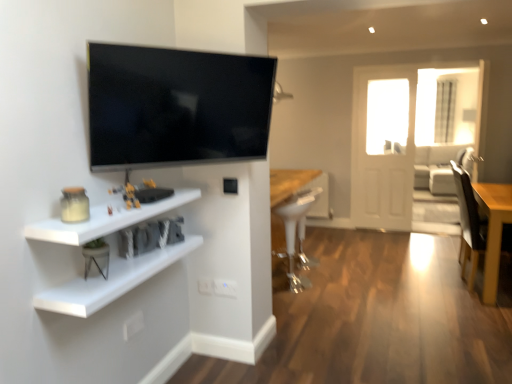
Question: Considering the relative sizes of white glossy stool at center and light gray fabric couch at right in the image provided, is white glossy stool at center bigger than light gray fabric couch at right?

Choices:
 (A) yes
 (B) no

Answer: (B)

Question: Can you confirm if white glossy stool at center is positioned to the right of light gray fabric couch at right?

Choices:
 (A) no
 (B) yes

Answer: (A)

Question: Considering the relative sizes of white glossy stool at center and light gray fabric couch at right in the image provided, is white glossy stool at center shorter than light gray fabric couch at right?

Choices:
 (A) yes
 (B) no

Answer: (A)

Question: Does white glossy stool at center have a greater width compared to light gray fabric couch at right?

Choices:
 (A) yes
 (B) no

Answer: (B)

Question: Does white glossy stool at center have a lesser width compared to light gray fabric couch at right?

Choices:
 (A) no
 (B) yes

Answer: (B)

Question: Can you confirm if white glossy stool at center is smaller than light gray fabric couch at right?

Choices:
 (A) yes
 (B) no

Answer: (A)

Question: From a real-world perspective, does white matte shelf at lower left, the second shelf in the bottom-to-top sequence, stand above light gray fabric couch at right?

Choices:
 (A) yes
 (B) no

Answer: (A)

Question: Does white matte shelf at lower left, which is counted as the 1th shelf, starting from the top, turn towards light gray fabric couch at right?

Choices:
 (A) yes
 (B) no

Answer: (B)

Question: Is white matte shelf at lower left, which is counted as the 1th shelf, starting from the top, to the right of light gray fabric couch at right from the viewer's perspective?

Choices:
 (A) yes
 (B) no

Answer: (B)

Question: Can you confirm if white matte shelf at lower left, the second shelf in the bottom-to-top sequence, is smaller than light gray fabric couch at right?

Choices:
 (A) no
 (B) yes

Answer: (B)

Question: Is white matte shelf at lower left, which is counted as the 1th shelf, starting from the top, facing away from light gray fabric couch at right?

Choices:
 (A) no
 (B) yes

Answer: (A)

Question: Is white matte shelf at lower left, which is counted as the 1th shelf, starting from the top, in front of light gray fabric couch at right?

Choices:
 (A) yes
 (B) no

Answer: (A)

Question: Can you see light brown wooden table at right touching white matte shelf at lower left, which ranks as the 2th shelf in top-to-bottom order?

Choices:
 (A) no
 (B) yes

Answer: (A)